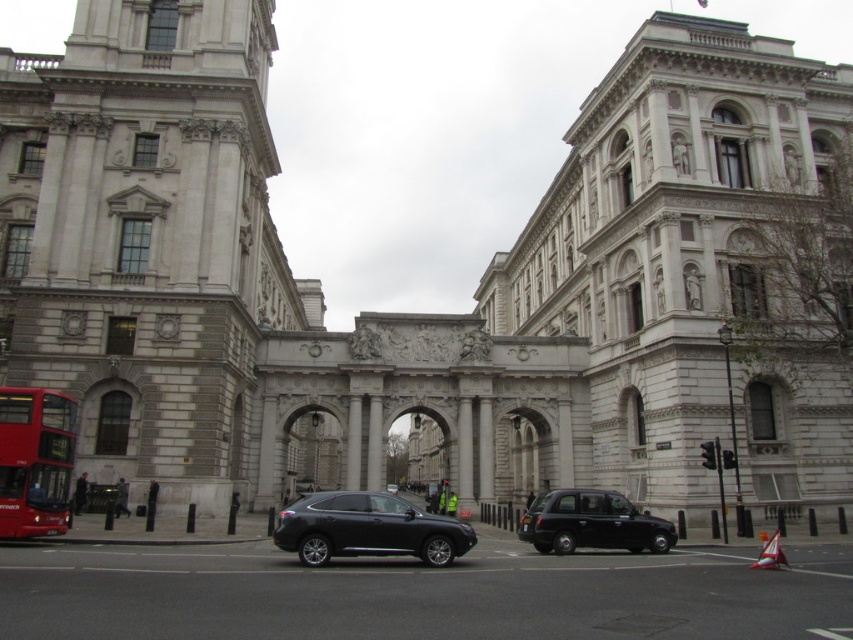
You are standing in front of the two classical buildings connected by the archway. There are two points marked in the image. The first point is at coordinate point (44, 518) and the second is at point (572, 516). Which point is nearer to you?

Point (44, 518) is closer to the viewer than point (572, 516).

You are a tour guide explaining the layout of this historical site to visitors. You mention both the shiny black suv at center and the red metallic bus at lower left. Which vehicle do you tell them is larger?

The shiny black suv at center is bigger than the red metallic bus at lower left, so you would inform the visitors that the shiny black suv at center is the larger vehicle.

You are standing in front of the two classical buildings connected by an archway. You notice two points marked in the image. The first point is at coordinate [347,500] and the second is at [68,444]. Which point is closer to your viewpoint?

Point [347,500] is closer to the camera than point [68,444].